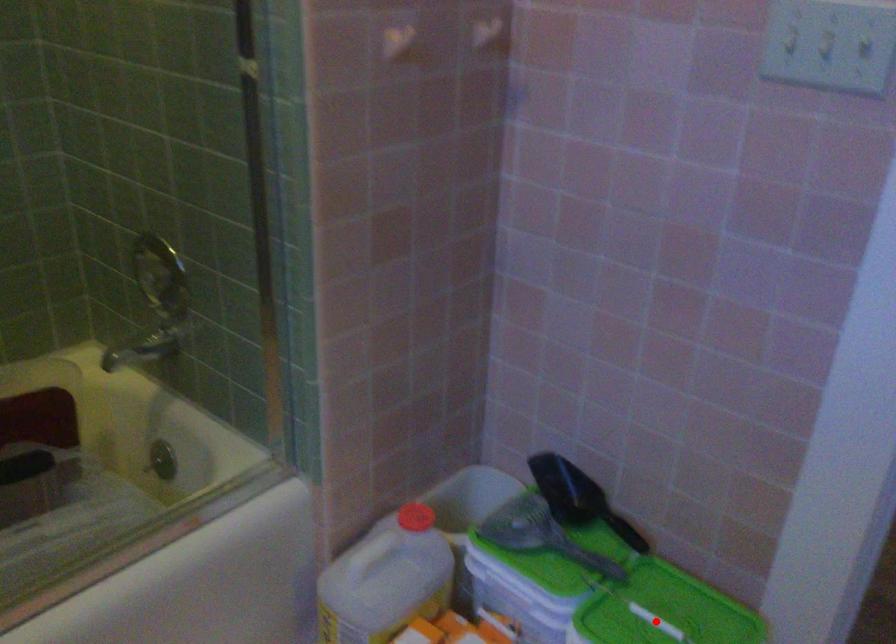
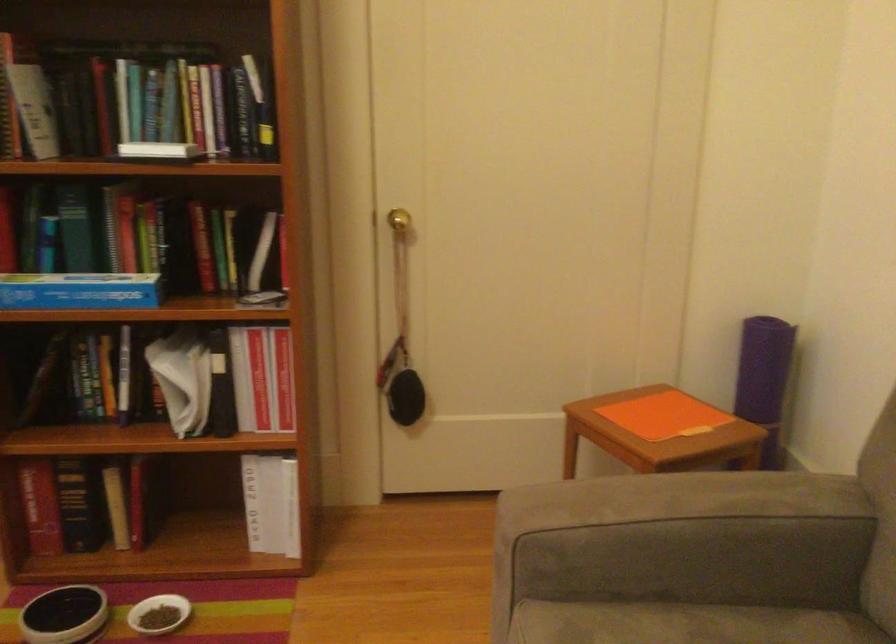
Question: I am providing you with two images of the same scene from different viewpoints. A red point is marked on the first image. At the location where the point appears in image 1, is it still visible in image 2?

Choices:
 (A) Yes
 (B) No

Answer: (B)